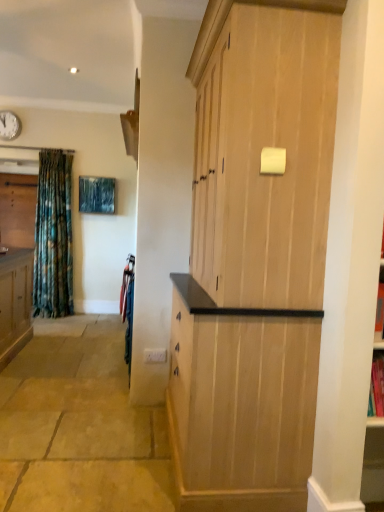
Question: Is white matte clock at upper left wider than natural wood cupboard at center?

Choices:
 (A) yes
 (B) no

Answer: (B)

Question: Are white matte clock at upper left and natural wood cupboard at center located far from each other?

Choices:
 (A) no
 (B) yes

Answer: (B)

Question: Could you tell me if white matte clock at upper left is turned towards natural wood cupboard at center?

Choices:
 (A) no
 (B) yes

Answer: (A)

Question: From the image's perspective, is white matte clock at upper left under natural wood cupboard at center?

Choices:
 (A) no
 (B) yes

Answer: (A)

Question: From a real-world perspective, is white matte clock at upper left beneath natural wood cupboard at center?

Choices:
 (A) no
 (B) yes

Answer: (A)

Question: Is white matte clock at upper left positioned behind natural wood cupboard at center?

Choices:
 (A) no
 (B) yes

Answer: (B)

Question: Is natural wood cupboard at center aimed at white matte clock at upper left?

Choices:
 (A) yes
 (B) no

Answer: (B)

Question: Considering the relative sizes of natural wood cupboard at center and white matte clock at upper left in the image provided, is natural wood cupboard at center smaller than white matte clock at upper left?

Choices:
 (A) yes
 (B) no

Answer: (B)

Question: Is natural wood cupboard at center further to camera compared to white matte clock at upper left?

Choices:
 (A) yes
 (B) no

Answer: (B)

Question: Is natural wood cupboard at center completely or partially outside of white matte clock at upper left?

Choices:
 (A) no
 (B) yes

Answer: (B)

Question: From the image's perspective, is natural wood cupboard at center below white matte clock at upper left?

Choices:
 (A) yes
 (B) no

Answer: (A)

Question: Does natural wood cupboard at center have a greater width compared to white matte clock at upper left?

Choices:
 (A) no
 (B) yes

Answer: (B)

Question: Looking at the image, does natural wood cupboard at center seem bigger or smaller compared to white matte clock at upper left?

Choices:
 (A) small
 (B) big

Answer: (B)